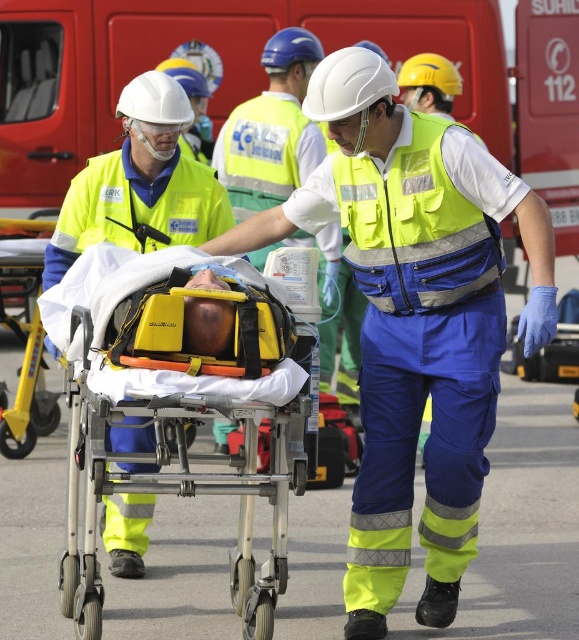
Question: Which point appears closest to the camera in this image?

Choices:
 (A) (1, 413)
 (B) (380, 406)
 (C) (178, 397)

Answer: (C)

Question: Estimate the real-world distances between objects in this image. Which object is farther from the yellow reflective vest at center?

Choices:
 (A) yellow plastic stretcher at lower left
 (B) yellow plastic stretcher at center

Answer: (A)

Question: Is yellow reflective vest at center to the right of yellow plastic stretcher at lower left from the viewer's perspective?

Choices:
 (A) yes
 (B) no

Answer: (A)

Question: Is yellow plastic stretcher at center smaller than yellow plastic stretcher at lower left?

Choices:
 (A) yes
 (B) no

Answer: (B)

Question: Can you confirm if yellow reflective vest at center is bigger than yellow plastic stretcher at lower left?

Choices:
 (A) no
 (B) yes

Answer: (B)

Question: Which point is closer to the camera?

Choices:
 (A) yellow plastic stretcher at lower left
 (B) yellow reflective vest at center
 (C) yellow plastic stretcher at center

Answer: (C)